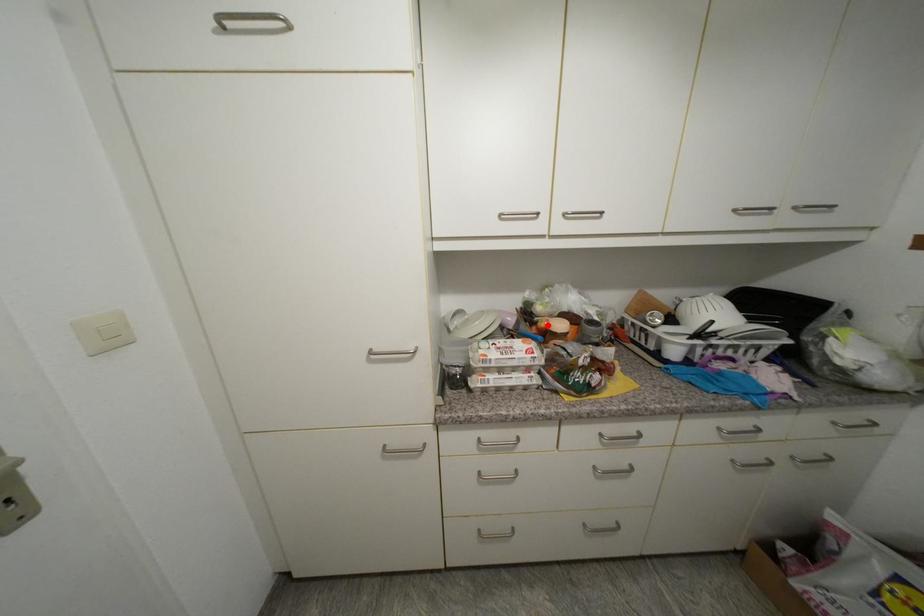
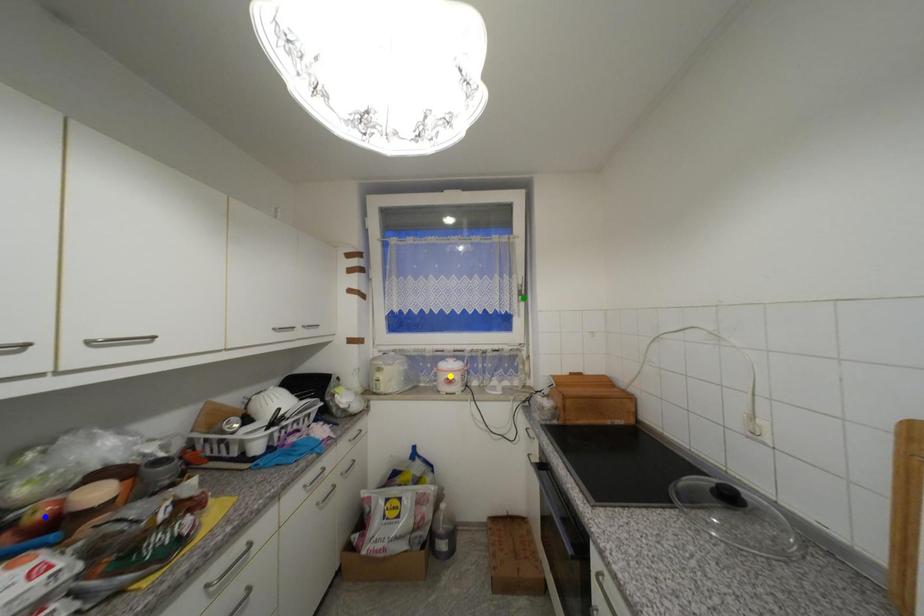
Question: I am providing you with two images of the same scene from different viewpoints. A red point is marked on the first image. You are given multiple points on the second image. In image 2, which mark is for the same physical point as the one in image 1?

Choices:
 (A) blue point
 (B) yellow point
 (C) green point

Answer: (A)